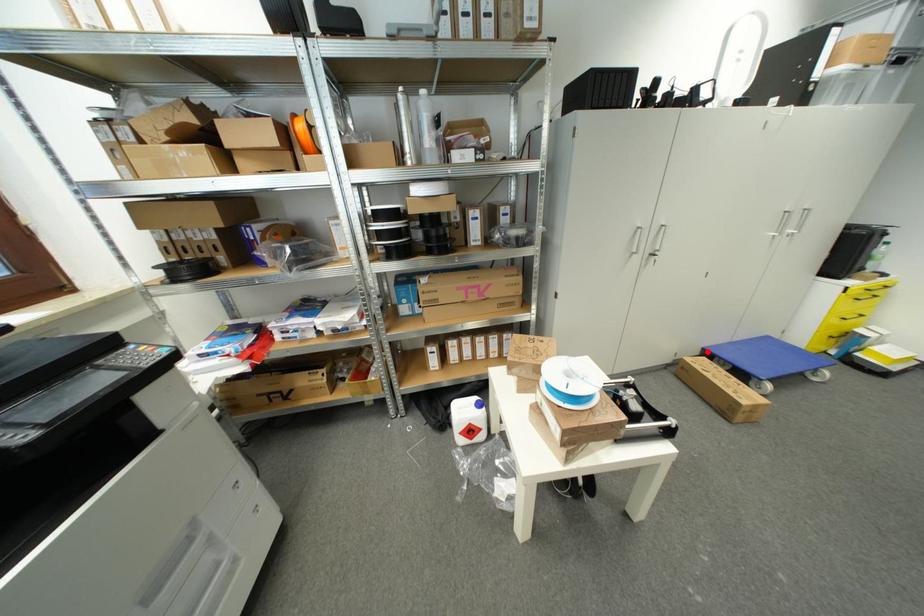
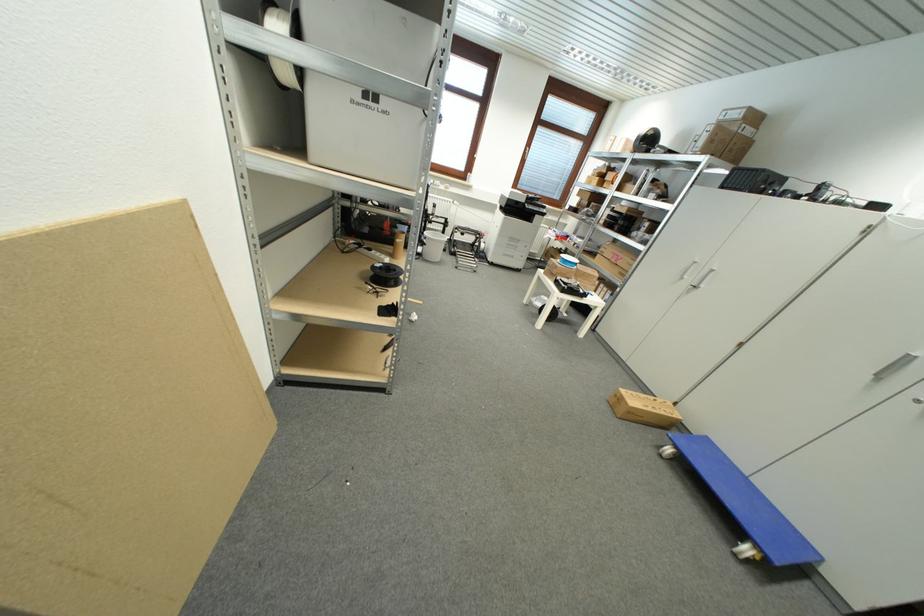
Find the pixel in the second image that matches the highlighted location in the first image.

(711, 440)